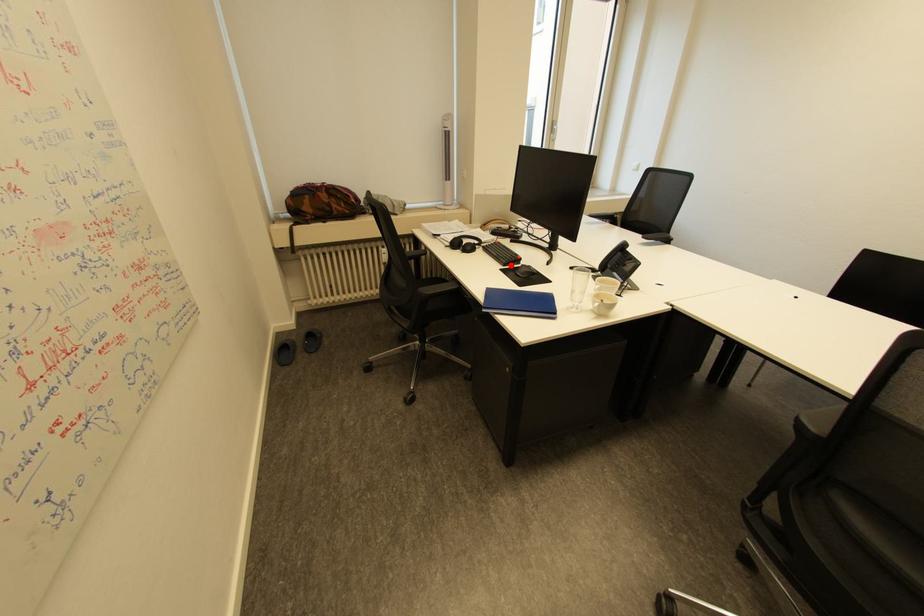
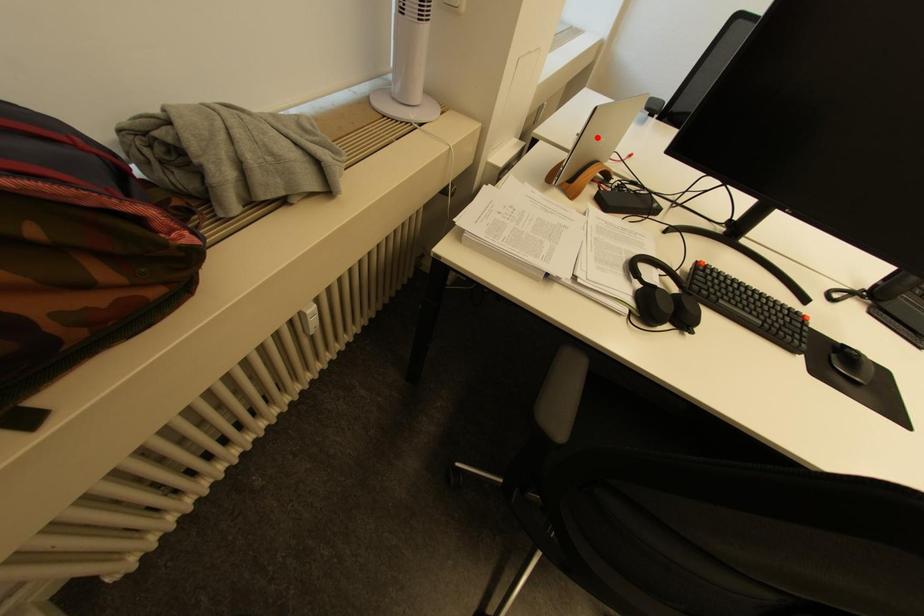
I am providing you with two images of the same scene from different viewpoints. A red point is marked on the first image and another point is marked on the second image. Does the point marked in image1 correspond to the same location as the one in image2?

No